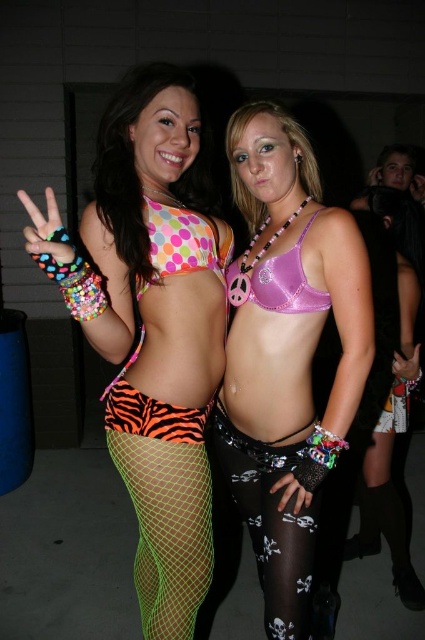
You are at the coordinates of point [306,604] and want to move to the point [306,220]. Is there an obstacle blocking your path?

Point [306,220] is behind point [306,604], so there is an obstacle blocking your path.